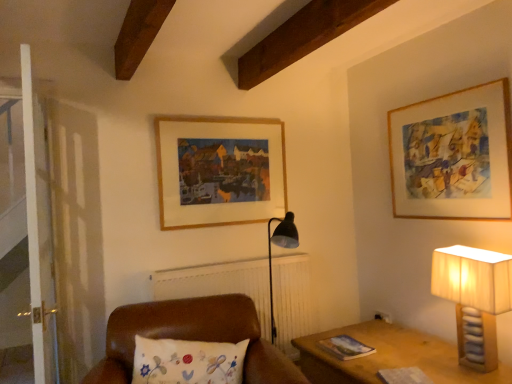
Question: Is wooden frame at upper right, the second picture frame in the left-to-right sequence, taller than leather cushion at center?

Choices:
 (A) yes
 (B) no

Answer: (A)

Question: Does wooden frame at upper right, positioned as the 1th picture frame in right-to-left order, have a lesser height compared to leather cushion at center?

Choices:
 (A) no
 (B) yes

Answer: (A)

Question: Could you tell me if wooden frame at upper right, the second picture frame in the left-to-right sequence, is facing leather cushion at center?

Choices:
 (A) no
 (B) yes

Answer: (B)

Question: Is wooden frame at upper right, positioned as the 1th picture frame in right-to-left order, in front of leather cushion at center?

Choices:
 (A) yes
 (B) no

Answer: (B)

Question: Is wooden frame at upper right, positioned as the 1th picture frame in right-to-left order, not inside leather cushion at center?

Choices:
 (A) yes
 (B) no

Answer: (A)

Question: From the image's perspective, relative to wooden frame at upper right, positioned as the 1th picture frame in right-to-left order, is beige fabric lampshade at right above or below?

Choices:
 (A) below
 (B) above

Answer: (A)

Question: Considering the positions of point (463, 249) and point (487, 213), is point (463, 249) closer or farther from the camera than point (487, 213)?

Choices:
 (A) farther
 (B) closer

Answer: (B)

Question: In terms of height, does beige fabric lampshade at right look taller or shorter compared to wooden frame at upper right, the second picture frame in the left-to-right sequence?

Choices:
 (A) short
 (B) tall

Answer: (A)

Question: Is beige fabric lampshade at right bigger or smaller than wooden frame at upper right, positioned as the 1th picture frame in right-to-left order?

Choices:
 (A) big
 (B) small

Answer: (A)

Question: Is leather cushion at center wider or thinner than beige fabric lampshade at right?

Choices:
 (A) thin
 (B) wide

Answer: (B)

Question: Do you think leather cushion at center is within beige fabric lampshade at right, or outside of it?

Choices:
 (A) outside
 (B) inside

Answer: (A)

Question: From their relative heights in the image, would you say leather cushion at center is taller or shorter than beige fabric lampshade at right?

Choices:
 (A) short
 (B) tall

Answer: (A)

Question: Considering the positions of leather cushion at center and beige fabric lampshade at right in the image, is leather cushion at center bigger or smaller than beige fabric lampshade at right?

Choices:
 (A) big
 (B) small

Answer: (A)

Question: Considering the positions of beige fabric lampshade at right and leather cushion at center in the image, is beige fabric lampshade at right wider or thinner than leather cushion at center?

Choices:
 (A) thin
 (B) wide

Answer: (A)

Question: Would you say beige fabric lampshade at right is to the left or to the right of leather cushion at center in the picture?

Choices:
 (A) right
 (B) left

Answer: (A)